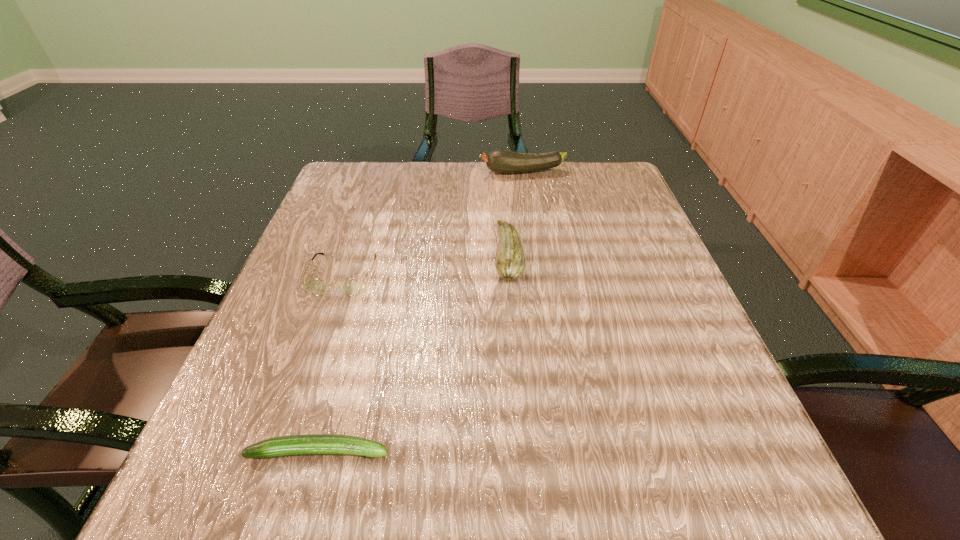
Select which zucchini is the second closest to the third tallest object. Please provide its 2D coordinates. Your answer should be formatted as a tuple, i.e. [(x, y)], where the tuple contains the x and y coordinates of a point satisfying the conditions above.

[(312, 444)]

What are the coordinates of `vacant space that satisfies the following two spatial constraints: 1. at the blossom end of the farthest zucchini; 2. on the lenses of the second shortest object` in the screenshot? It's located at (538, 274).

You are a GUI agent. You are given a task and a screenshot of the screen. Output one action in this format:
    pyautogui.click(x=<x>, y=<y>)
    Task: Click on the vacant area that satisfies the following two spatial constraints: 1. at the stem end of the second nearest zucchini; 2. on the lenses of the third tallest object
    
    Given the screenshot: What is the action you would take?
    pyautogui.click(x=510, y=274)